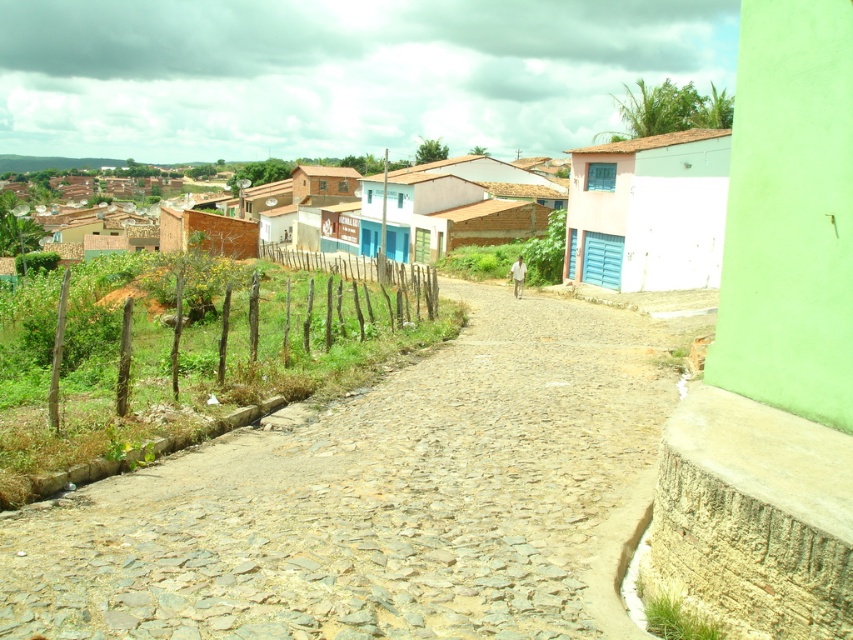
Question: Does green grassy vineyard at lower left come in front of white painted wall at center?

Choices:
 (A) yes
 (B) no

Answer: (A)

Question: Is green grassy vineyard at lower left in front of white painted wood hut at center-right?

Choices:
 (A) yes
 (B) no

Answer: (A)

Question: Which object is positioned farthest from the brown cobblestone dirt track at center?

Choices:
 (A) brown textured hut at center-left
 (B) white painted brick house at center
 (C) green grassy vineyard at lower left

Answer: (A)

Question: Estimate the real-world distances between objects in this image. Which object is farther from the brown textured hut at center-left?

Choices:
 (A) green grassy vineyard at lower left
 (B) white painted wall at center

Answer: (A)

Question: Which point is farther from the camera taking this photo?

Choices:
 (A) (720, 186)
 (B) (521, 541)
 (C) (247, 422)

Answer: (A)

Question: Does green grassy vineyard at lower left have a greater width compared to white painted wood hut at center-right?

Choices:
 (A) yes
 (B) no

Answer: (A)